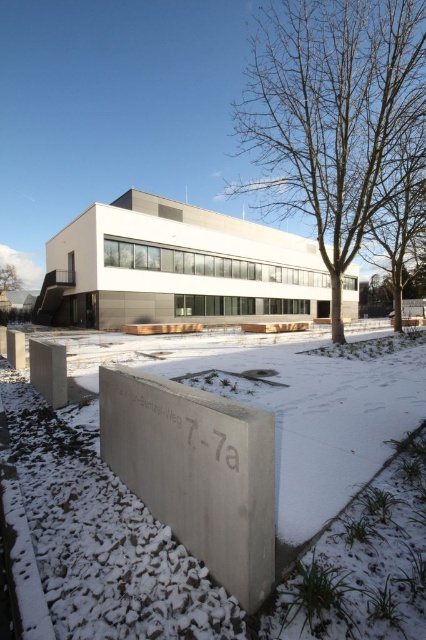
Question: Which object is closer to the camera taking this photo?

Choices:
 (A) bare wood tree at center
 (B) brown wood tree at upper left

Answer: (A)

Question: Is the position of bare wood tree at center less distant than that of brown wood tree at upper left?

Choices:
 (A) yes
 (B) no

Answer: (A)

Question: Is bare wood tree at center wider than brown wood tree at upper left?

Choices:
 (A) no
 (B) yes

Answer: (B)

Question: Does bare wood tree at center come behind brown wood tree at upper left?

Choices:
 (A) yes
 (B) no

Answer: (B)